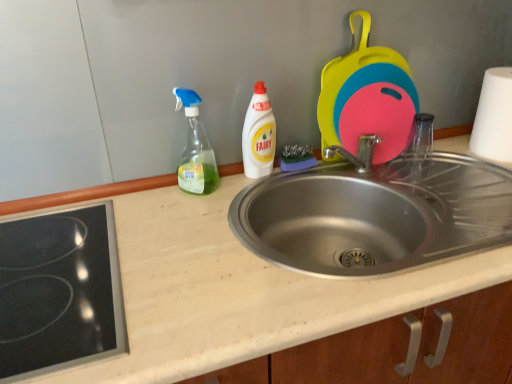
Where is `vacant space in front of white plastic bottle at center, which ranks as the 2th bottle in left-to-right order`? vacant space in front of white plastic bottle at center, which ranks as the 2th bottle in left-to-right order is located at coordinates (234, 204).